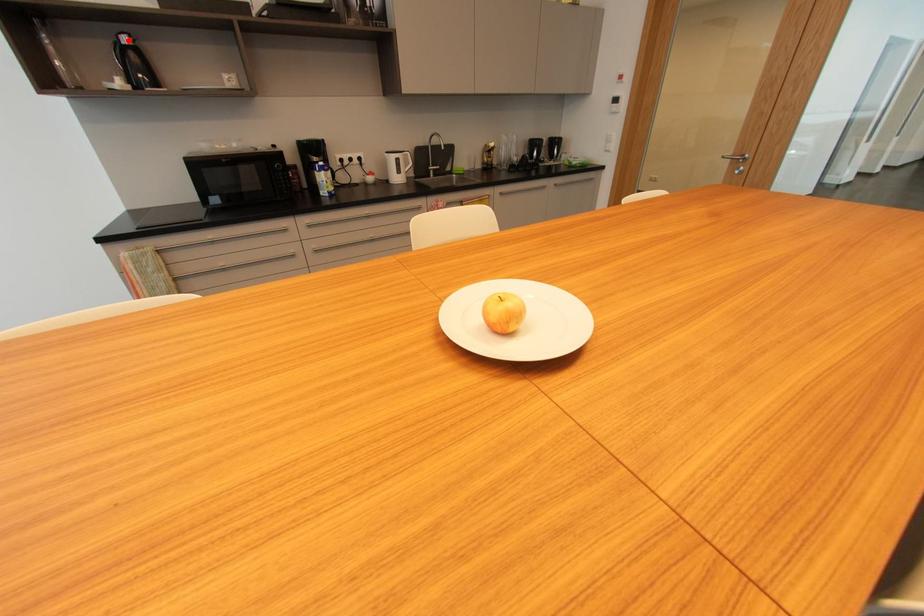
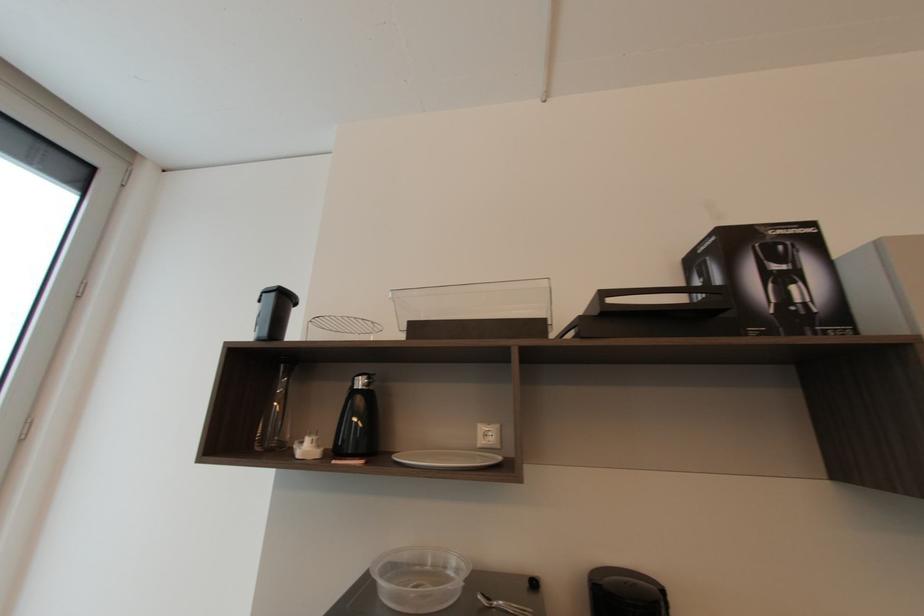
Question: I am providing you with two images of the same scene from different viewpoints. Image1 has a red point marked. In image2, the corresponding 3D location appears at what relative position? Reply with the corresponding letter.

Choices:
 (A) Closer
 (B) Farther

Answer: (A)